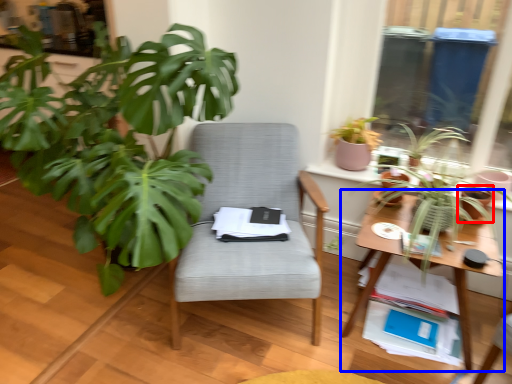
Question: Which object appears closest to the camera in this image, flowerpot (highlighted by a red box) or table (highlighted by a blue box)?

Choices:
 (A) flowerpot
 (B) table

Answer: (B)